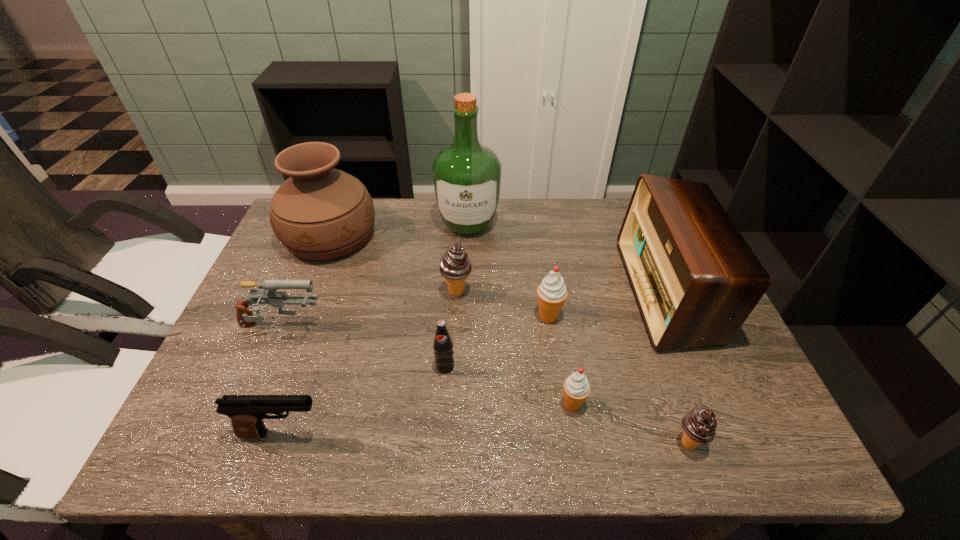
Find the location of a particular element. The width and height of the screenshot is (960, 540). object that is at the near right corner is located at coordinates tap(699, 425).

Identify the location of free space at the far edge. Image resolution: width=960 pixels, height=540 pixels. [x=523, y=206].

Where is `vacant space at the near edge`? This screenshot has height=540, width=960. vacant space at the near edge is located at coordinates (489, 451).

The height and width of the screenshot is (540, 960). I want to click on vacant space at the right edge of the desktop, so click(x=750, y=394).

Find the location of a particular element. This screenshot has width=960, height=540. empty location between the smaller red icecream and the urn is located at coordinates (451, 320).

You are a GUI agent. You are given a task and a screenshot of the screen. Output one action in this format:
    pyautogui.click(x=<x>, y=<y>)
    Task: Click on the unoccupied area between the radio receiver and the black pistol
    
    Given the screenshot: What is the action you would take?
    pos(474,363)

The width and height of the screenshot is (960, 540). Identify the location of vacant space that's between the urn and the pistol. 306,335.

Locate an element on the screen. vacant area that lies between the smaller red icecream and the tallest object is located at coordinates (520, 314).

The width and height of the screenshot is (960, 540). I want to click on empty space between the green liquor and the radio receiver, so click(x=567, y=258).

Find the location of a particular element. The width and height of the screenshot is (960, 540). vacant space in between the gun and the bigger chocolate icecream is located at coordinates (369, 310).